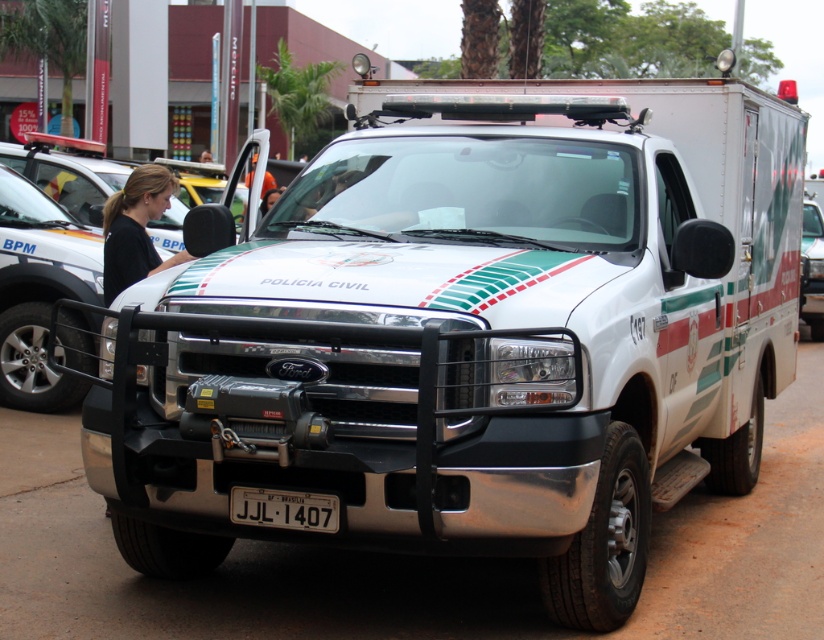
Which is below, black fabric shirt at center or white glossy truck at center?

black fabric shirt at center

Which is above, black fabric shirt at center or white glossy truck at center?

white glossy truck at center is higher up.

Describe the element at coordinates (134, 228) in the screenshot. Image resolution: width=824 pixels, height=640 pixels. I see `black fabric shirt at center` at that location.

Where is `black fabric shirt at center`? The image size is (824, 640). black fabric shirt at center is located at coordinates (134, 228).

Does black fabric shirt at center have a greater height compared to white plastic license plate at center?

Yes.

Who is shorter, black fabric shirt at center or white plastic license plate at center?

white plastic license plate at center

Locate an element on the screen. black fabric shirt at center is located at coordinates (134, 228).

At what (x,y) coordinates should I click in order to perform the action: click on black fabric shirt at center. Please return your answer as a coordinate pair (x, y). The width and height of the screenshot is (824, 640). Looking at the image, I should click on (134, 228).

You are a GUI agent. You are given a task and a screenshot of the screen. Output one action in this format:
    pyautogui.click(x=<x>, y=<y>)
    Task: Click on the white plastic license plate at center
    
    Given the screenshot: What is the action you would take?
    pyautogui.click(x=284, y=508)

Which is below, white plastic license plate at center or white glossy truck at center?

Positioned lower is white plastic license plate at center.

I want to click on white plastic license plate at center, so click(284, 508).